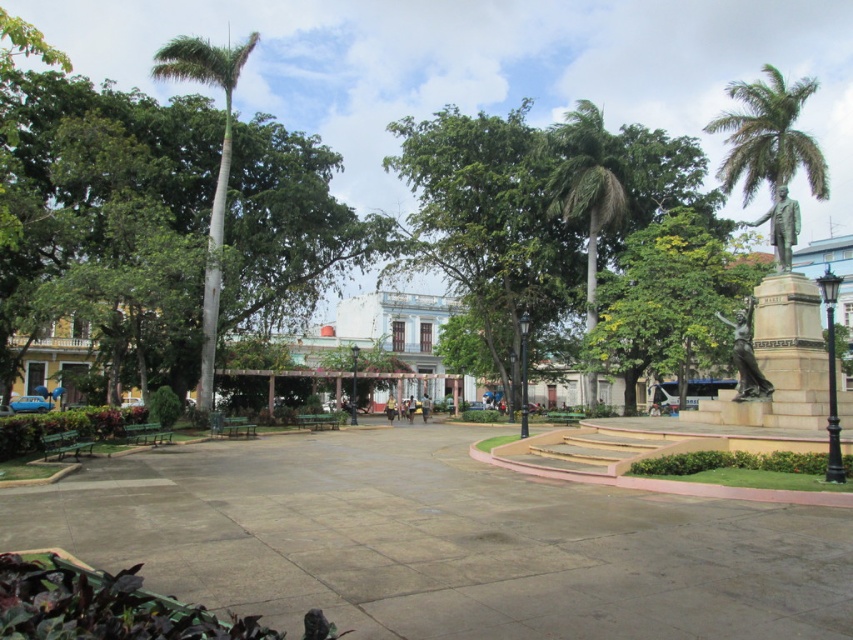
How distant is green leafy palm tree at center from green smooth palm tree at left?

They are 66.00 feet apart.

Can you confirm if green leafy palm tree at center is positioned to the left of green smooth palm tree at left?

No, green leafy palm tree at center is not to the left of green smooth palm tree at left.

Which is behind, point (569, 124) or point (213, 324)?

The point (569, 124) is behind.

Identify the location of green leafy palm tree at center. Image resolution: width=853 pixels, height=640 pixels. (589, 182).

Does green leafy palm tree at upper right lie in front of green smooth palm tree at left?

No, it is not.

Is green leafy palm tree at upper right taller than green smooth palm tree at left?

No.

This screenshot has width=853, height=640. I want to click on green leafy palm tree at upper right, so click(769, 136).

Who is more forward, (514, 637) or (584, 218)?

Point (514, 637) is in front.

Is point (549, 604) less distant than point (589, 385)?

That is True.

Locate an element on the screen. The width and height of the screenshot is (853, 640). concrete at center is located at coordinates (440, 541).